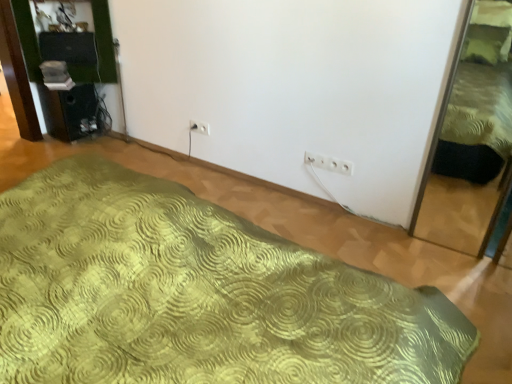
Question: Is white plastic electric outlet at center, the second electric outlet when ordered from bottom to top, taller or shorter than green textured bed at right, which is counted as the 2th bed, starting from the left?

Choices:
 (A) short
 (B) tall

Answer: (A)

Question: Is point (193, 127) positioned closer to the camera than point (476, 225)?

Choices:
 (A) farther
 (B) closer

Answer: (A)

Question: Based on their relative distances, which object is nearer to the white plastic electric outlet at center, which appears as the second electric outlet when viewed from the left?

Choices:
 (A) green textured bed at right, the first bed from the right
 (B) green textured bed at center, the first bed in the left-to-right sequence
 (C) white plastic electric outlet at center, which ranks as the first electric outlet in top-to-bottom order

Answer: (A)

Question: Which of these objects is positioned closest to the green textured bed at center, which appears as the second bed when viewed from the right?

Choices:
 (A) green textured bed at right, the first bed from the right
 (B) white plastic electric outlet at center, placed as the second electric outlet when sorted from front to back
 (C) white plastic electric outlet at center, which is counted as the 1th electric outlet, starting from the right

Answer: (C)